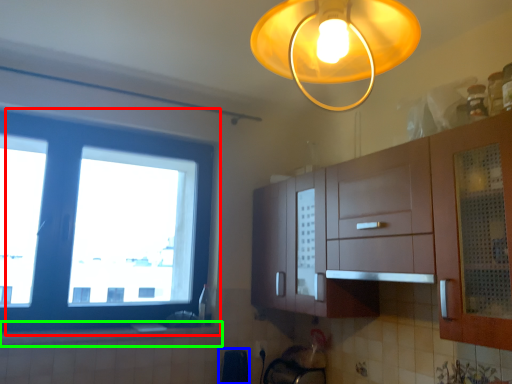
Question: Based on their relative distances, which object is nearer to window (highlighted by a red box)? Choose from appliance (highlighted by a blue box) and counter top (highlighted by a green box).

Choices:
 (A) appliance
 (B) counter top

Answer: (B)